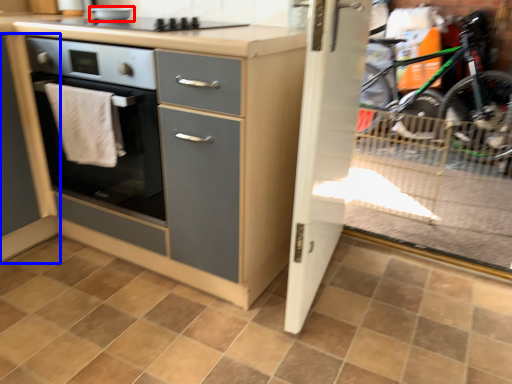
Question: Among these objects, which one is farthest to the camera, appliance (highlighted by a red box) or cabinetry (highlighted by a blue box)?

Choices:
 (A) appliance
 (B) cabinetry

Answer: (A)